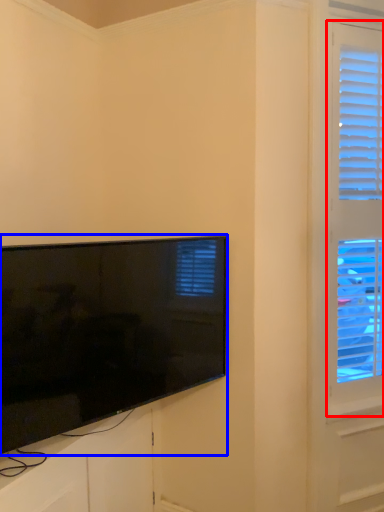
Question: Among these objects, which one is farthest to the camera, window (highlighted by a red box) or television (highlighted by a blue box)?

Choices:
 (A) window
 (B) television

Answer: (A)